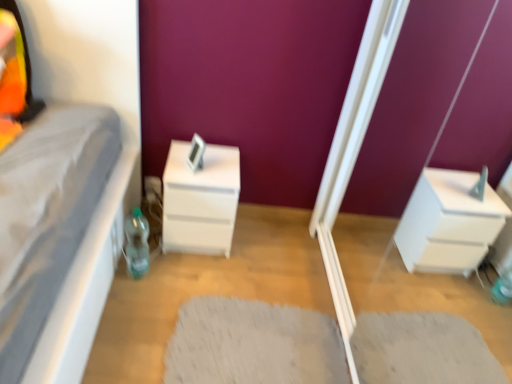
Question: From a real-world perspective, is white shaggy rug at center above or below translucent plastic bottle at lower left?

Choices:
 (A) below
 (B) above

Answer: (A)

Question: Visually, is white shaggy rug at center positioned to the left or to the right of translucent plastic bottle at lower left?

Choices:
 (A) left
 (B) right

Answer: (B)

Question: Which object is positioned closest to the white glossy screen door at lower right?

Choices:
 (A) white matte chest of drawers at center
 (B) white shaggy rug at center
 (C) translucent plastic bottle at lower left

Answer: (B)

Question: Which object is positioned closest to the white shaggy rug at center?

Choices:
 (A) white matte chest of drawers at center
 (B) translucent plastic bottle at lower left
 (C) white glossy screen door at lower right

Answer: (C)